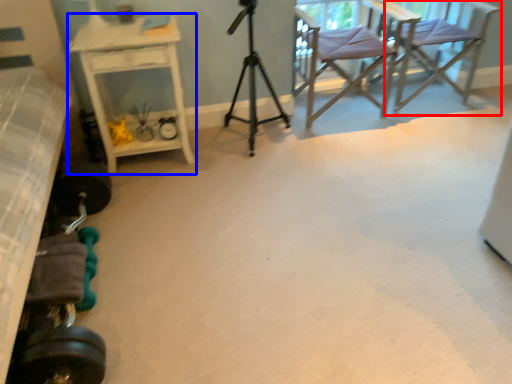
Question: Which object is closer to the camera taking this photo, chair (highlighted by a red box) or desk (highlighted by a blue box)?

Choices:
 (A) chair
 (B) desk

Answer: (B)